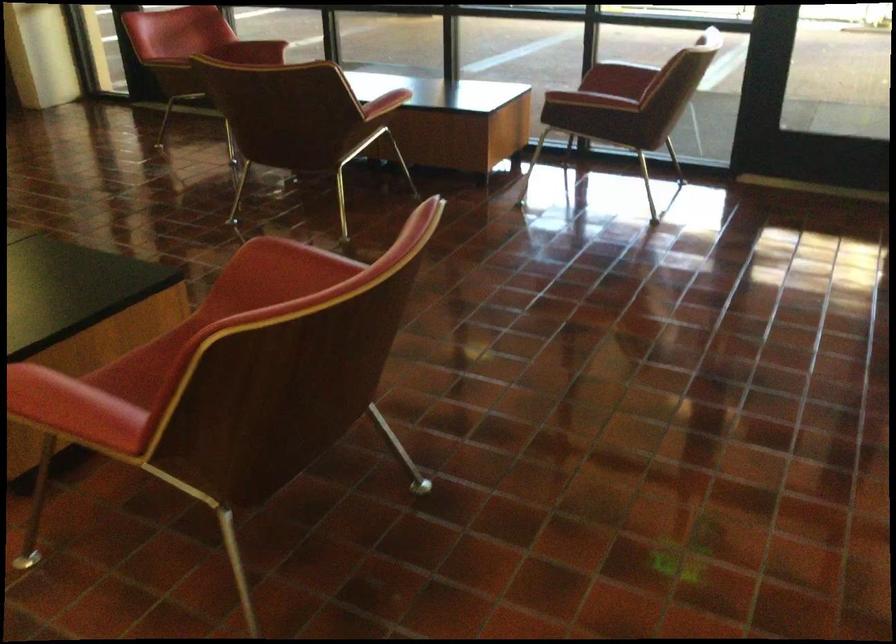
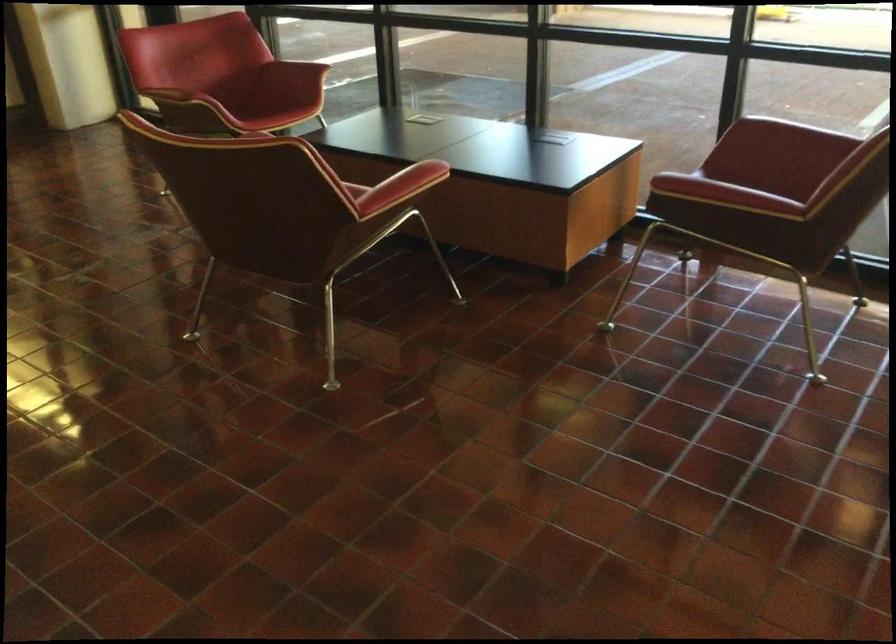
Question: In a continuous first-person perspective shot, in which direction is the camera moving?

Choices:
 (A) Left
 (B) Right
 (C) Forward
 (D) Backward

Answer: (C)